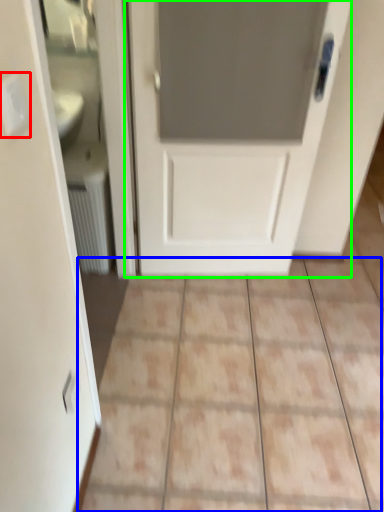
Question: Based on their relative distances, which object is nearer to electric outlet (highlighted by a red box)? Choose from ceramic tile (highlighted by a blue box) and door (highlighted by a green box).

Choices:
 (A) ceramic tile
 (B) door

Answer: (B)